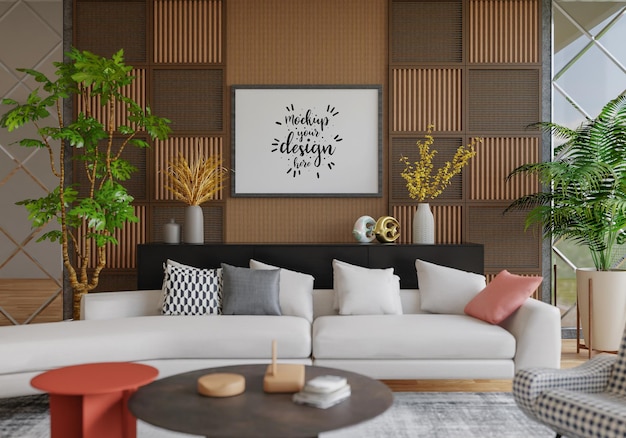
This screenshot has height=438, width=626. I want to click on white and blue armchair, so click(576, 410).